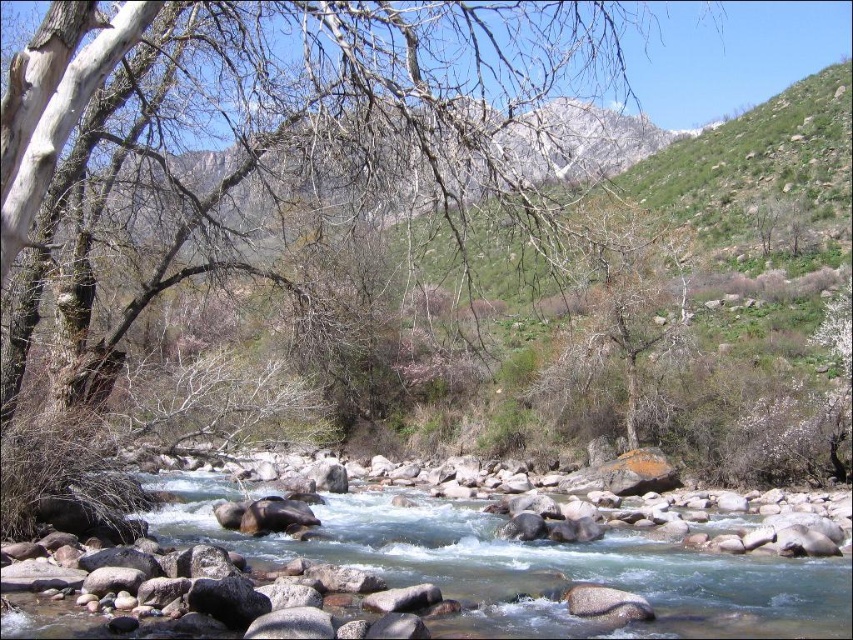
Does smooth gray rocks at center have a lesser height compared to gray bark tree at center?

Correct, smooth gray rocks at center is not as tall as gray bark tree at center.

What do you see at coordinates (531, 566) in the screenshot? I see `smooth gray rocks at center` at bounding box center [531, 566].

Between point (848, 557) and point (555, 413), which one is positioned behind?

The point (555, 413) is more distant.

The width and height of the screenshot is (853, 640). Identify the location of smooth gray rocks at center. (531, 566).

Is smooth bark tree at center to the left of smooth gray rocks at center from the viewer's perspective?

No, smooth bark tree at center is not to the left of smooth gray rocks at center.

Between smooth bark tree at center and smooth gray rocks at center, which one appears on the right side from the viewer's perspective?

smooth bark tree at center is more to the right.

Locate an element on the screen. smooth bark tree at center is located at coordinates (289, 140).

The image size is (853, 640). In order to click on smooth bark tree at center in this screenshot , I will do `click(289, 140)`.

Is smooth bark tree at center positioned behind gray bark tree at center?

No, smooth bark tree at center is closer to the viewer.

Is point (97, 51) positioned after point (604, 307)?

That is False.

Identify the location of smooth bark tree at center. This screenshot has height=640, width=853. (289, 140).

Where is `smooth bark tree at center`? This screenshot has width=853, height=640. smooth bark tree at center is located at coordinates (289, 140).